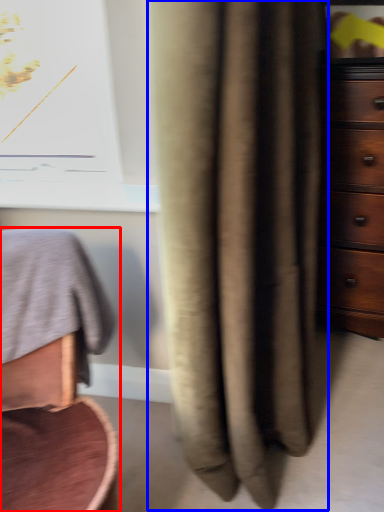
Question: Which object is closer to the camera taking this photo, furniture (highlighted by a red box) or curtain (highlighted by a blue box)?

Choices:
 (A) furniture
 (B) curtain

Answer: (A)